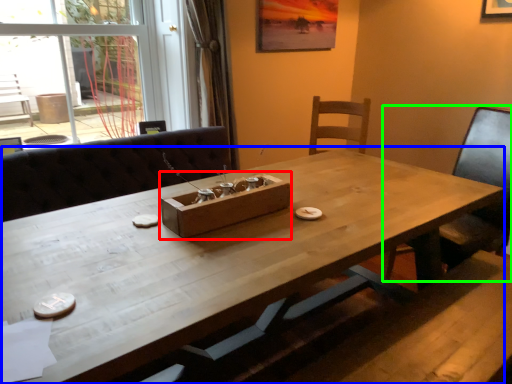
Question: Which is nearer to the cardboard box (highlighted by a red box)? table (highlighted by a blue box) or chair (highlighted by a green box).

Choices:
 (A) table
 (B) chair

Answer: (A)